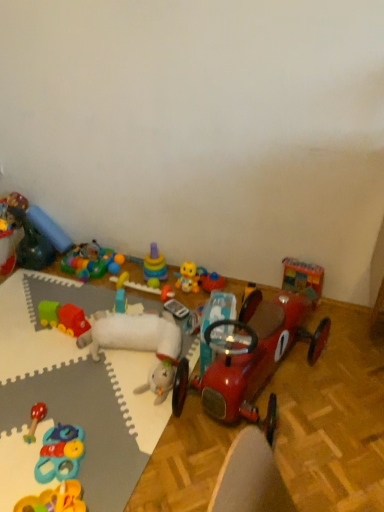
This screenshot has width=384, height=512. What are the coordinates of `free space in front of white plush lamb at lower left, acting as the eighth toy starting from the left` in the screenshot? It's located at (101, 414).